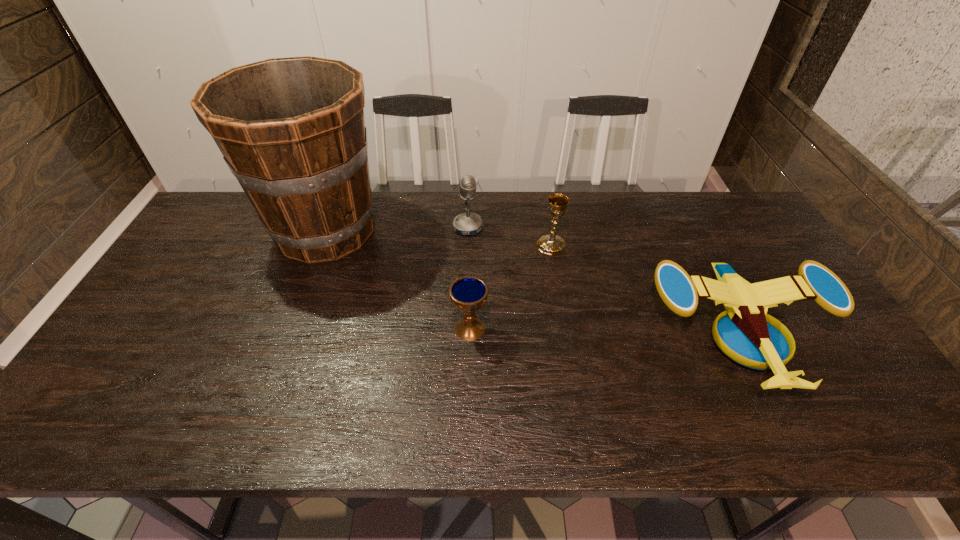
This screenshot has height=540, width=960. I want to click on the tallest object, so click(292, 131).

At what (x,y) coordinates should I click in order to perform the action: click on the leftmost object. Please return your answer as a coordinate pair (x, y). The image size is (960, 540). Looking at the image, I should click on (292, 131).

Find the location of a particular element. Image resolution: width=960 pixels, height=540 pixels. microphone is located at coordinates (468, 223).

Find the location of `the farther chalice`. the farther chalice is located at coordinates click(551, 244).

At what (x,y) coordinates should I click in order to perform the action: click on the fourth object from left to right. Please return your answer as a coordinate pair (x, y). This screenshot has width=960, height=540. Looking at the image, I should click on (551, 244).

Locate an element on the screen. The height and width of the screenshot is (540, 960). the nearer chalice is located at coordinates pos(468,294).

Where is `the shorter chalice`? The image size is (960, 540). the shorter chalice is located at coordinates (468, 294).

Locate an element on the screen. the rightmost object is located at coordinates (749, 336).

This screenshot has height=540, width=960. In order to click on free space located on the front of the tallest object in this screenshot , I will do `click(276, 364)`.

Where is `vacant region located on the front-facing side of the microphone`? vacant region located on the front-facing side of the microphone is located at coordinates (541, 227).